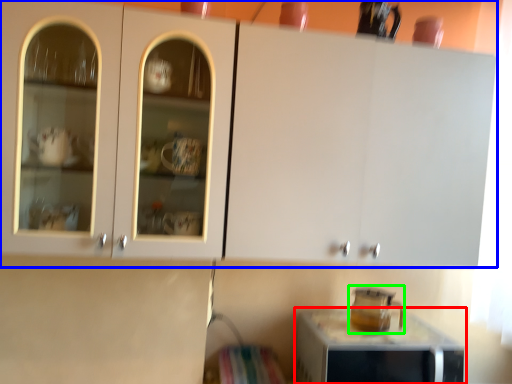
Question: Based on their relative distances, which object is farther from home appliance (highlighted by a red box)? Choose from cabinetry (highlighted by a blue box) and appliance (highlighted by a green box).

Choices:
 (A) cabinetry
 (B) appliance

Answer: (A)